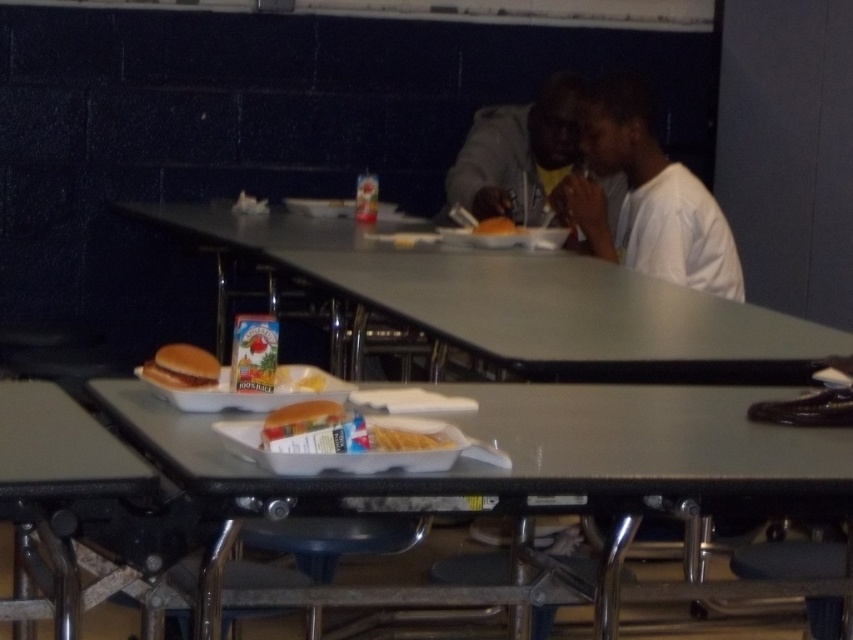
Question: Can you confirm if metallic gray tray at center is smaller than white paper tray at center?

Choices:
 (A) no
 (B) yes

Answer: (A)

Question: Is white matte shirt at upper right above white paper plate at upper center?

Choices:
 (A) no
 (B) yes

Answer: (B)

Question: Which object is positioned closest to the white paper plate at upper center?

Choices:
 (A) white paper tray at center
 (B) dark gray hoodie at upper right
 (C) golden brown bun at center
 (D) metallic gray tray at center

Answer: (B)

Question: Which object is the closest to the white matte shirt at upper right?

Choices:
 (A) white paper tray at center
 (B) golden brown bun at center

Answer: (A)

Question: Is metallic gray tray at center positioned behind white paper plate at upper center?

Choices:
 (A) no
 (B) yes

Answer: (A)

Question: Estimate the real-world distances between objects in this image. Which object is farther from the white matte shirt at upper right?

Choices:
 (A) white paper plate at upper center
 (B) golden brown bun at center
 (C) white paper tray at center

Answer: (B)